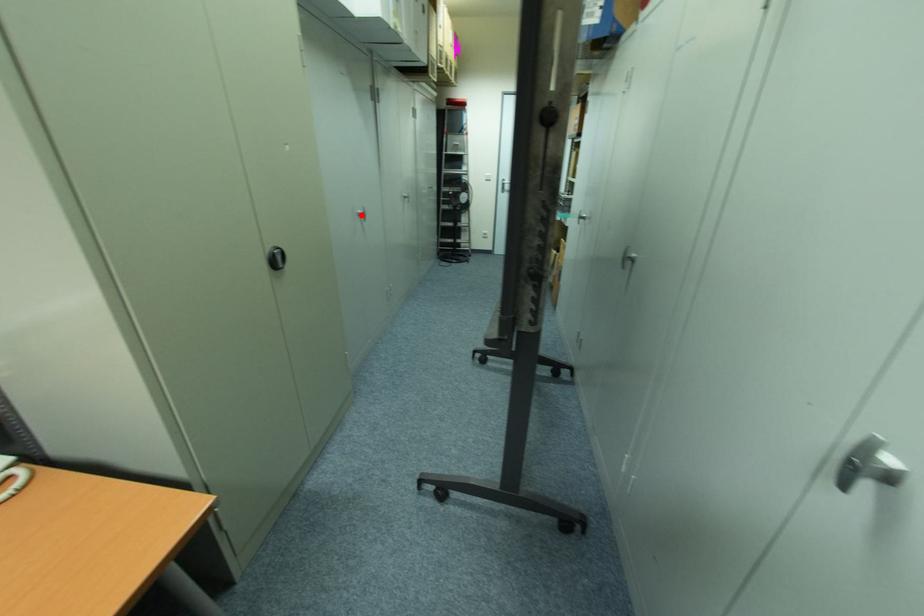
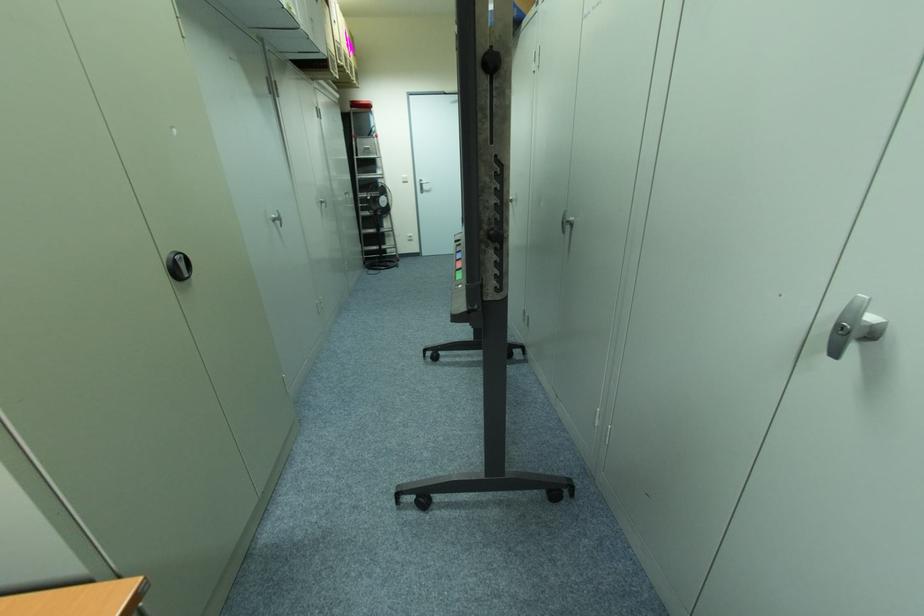
Where in the second image is the point corresponding to the highlighted location from the first image?

(274, 220)